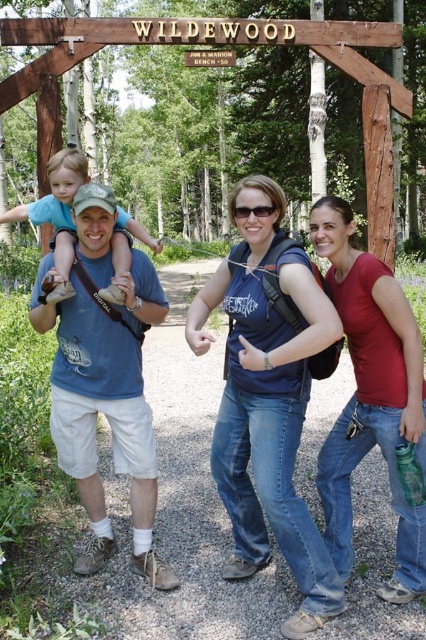
Question: Does blue cotton t-shirt at center appear on the right side of matte blue shirt at center?

Choices:
 (A) no
 (B) yes

Answer: (B)

Question: Observing the image, what is the correct spatial positioning of matte red shirt at center in reference to matte blue shirt at center?

Choices:
 (A) above
 (B) below

Answer: (B)

Question: Does matte red shirt at center have a lesser width compared to matte blue shirt at center?

Choices:
 (A) no
 (B) yes

Answer: (B)

Question: Among these objects, which one is farthest from the camera?

Choices:
 (A) blue cotton t-shirt at center
 (B) blue denim jeans at center

Answer: (A)

Question: Which object appears farthest from the camera in this image?

Choices:
 (A) matte blue shirt at center
 (B) blue cotton t-shirt at center

Answer: (A)

Question: Which point is farther to the camera?

Choices:
 (A) click(x=342, y=460)
 (B) click(x=71, y=220)
 (C) click(x=264, y=212)
 (D) click(x=141, y=440)

Answer: (B)